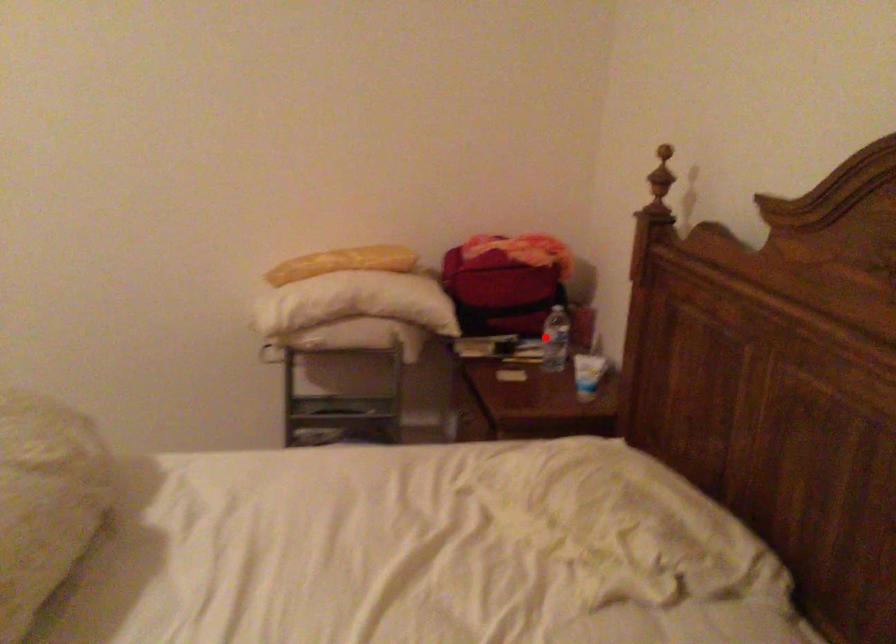
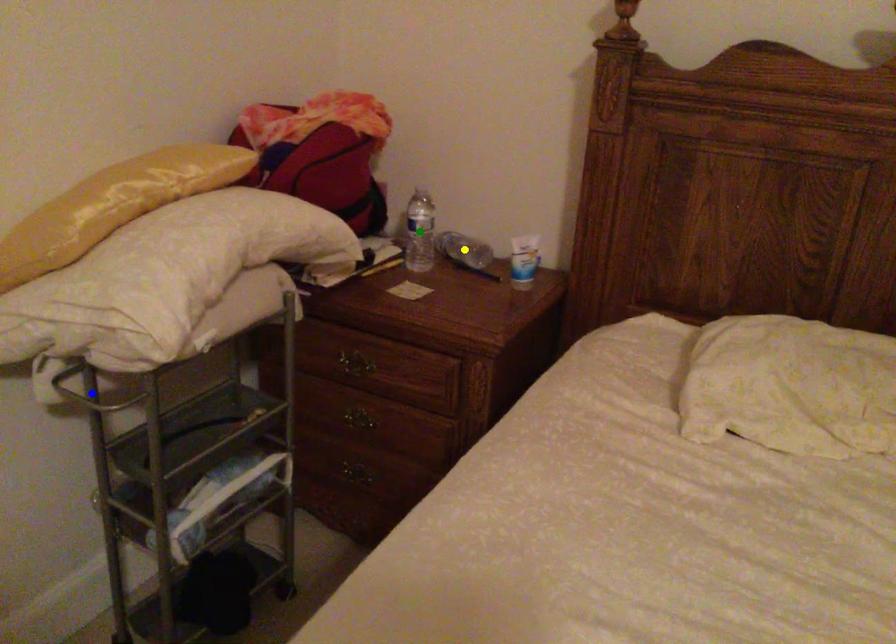
Question: I am providing you with two images of the same scene from different viewpoints. A red point is marked on the first image. You are given multiple points on the second image. Which point in image 2 is actually the same real-world point as the red point in image 1?

Choices:
 (A) yellow point
 (B) green point
 (C) blue point

Answer: (B)